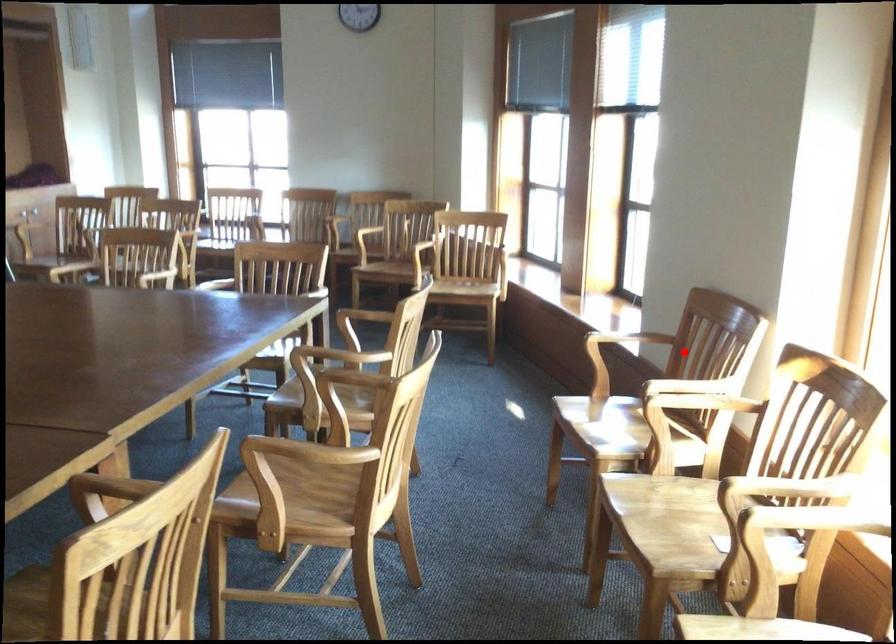
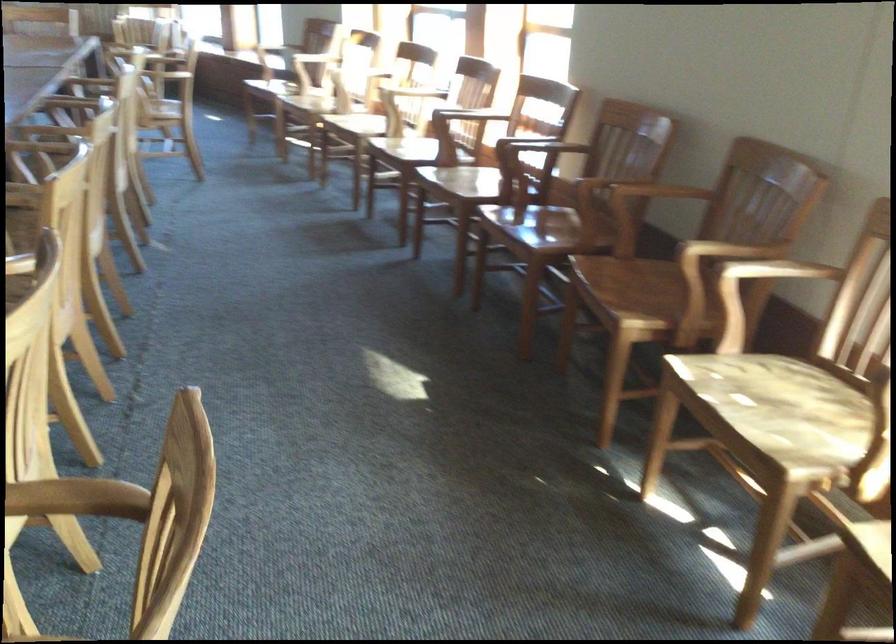
The point at the highlighted location is marked in the first image. Where is the corresponding point in the second image?

(312, 58)